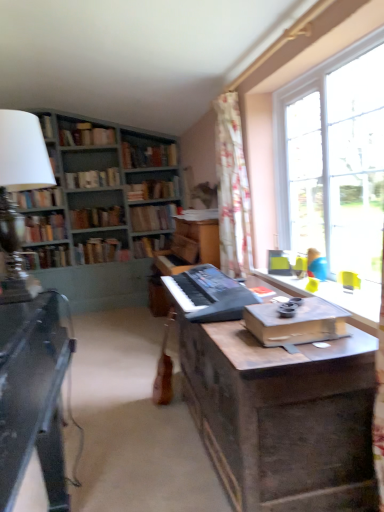
Question: From the image's perspective, is clear glass window at upper right above or below green painted wood bookcase at upper left?

Choices:
 (A) above
 (B) below

Answer: (B)

Question: From a real-world perspective, is clear glass window at upper right positioned above or below green painted wood bookcase at upper left?

Choices:
 (A) below
 (B) above

Answer: (B)

Question: Which of these objects is positioned closest to the hardcover book at center, which is counted as the eighth book, starting from the bottom?

Choices:
 (A) hardcover book at left, positioned as the 4th book in bottom-to-top order
 (B) wooden bookshelf at center, marked as the third book in a bottom-to-top arrangement
 (C) black matte keyboard at center
 (D) hardcover book at left, which is counted as the eleventh book, starting from the top
 (E) black matte keyboard at center

Answer: (B)

Question: Which object is the farthest from the green painted wood bookcase at upper left?

Choices:
 (A) hardcover books at upper left, which ranks as the 1th book in top-to-bottom order
 (B) wooden bookshelf at left
 (C) wooden desk at center
 (D) hardcover book at center, which is the sixth book in top-to-bottom order
 (E) hardcover book at center, which is counted as the eighth book, starting from the bottom

Answer: (C)